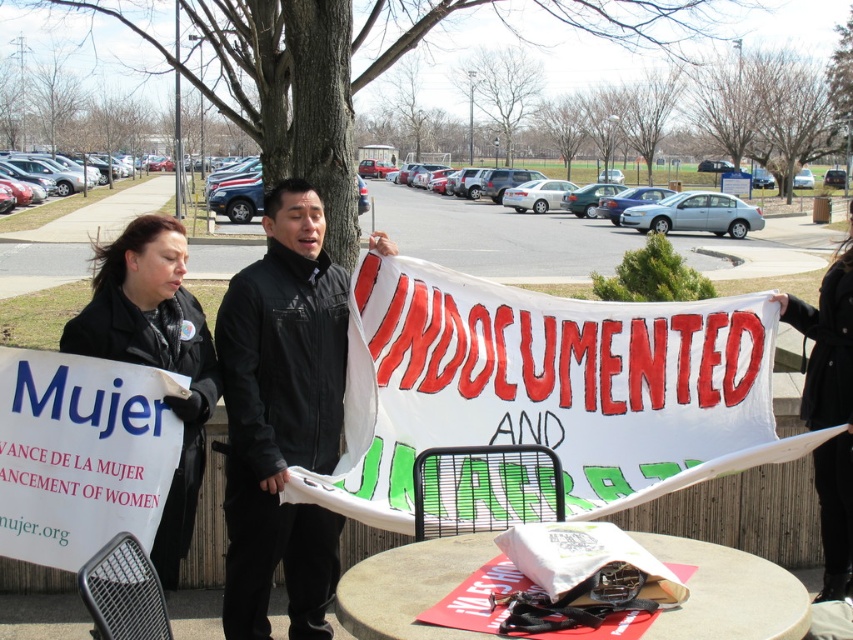
You are a photographer trying to capture a clear shot of both the black matte jacket at center and the black fabric sign at right. From your current position, which object is closer to the camera?

The black matte jacket at center is positioned under the black fabric sign at right, so the jacket is closer to the camera than the sign.

Based on the photo, you are organizing a protest and need to decide which jacket to use for visibility. The black matte jacket at center and the black leather jacket at lower left are available. Based on their sizes, which jacket would be more visible from a distance?

The black matte jacket at center is bigger than the black leather jacket at lower left, so it would be more visible from a distance.

You are a photographer at the protest scene. You need to capture a photo that includes both the black leather jacket at lower left and the black fabric sign at right. Based on their positions, which object should appear on the left side of the photo?

The black leather jacket at lower left should appear on the left side of the photo because it is positioned to the left of the black fabric sign at right.